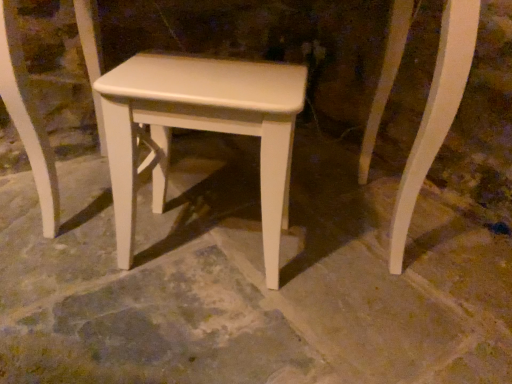
Question: Is white smooth concrete at center touching white matte stool at center?

Choices:
 (A) yes
 (B) no

Answer: (B)

Question: Considering the relative positions of white smooth concrete at center and white matte stool at center in the image provided, is white smooth concrete at center in front of white matte stool at center?

Choices:
 (A) no
 (B) yes

Answer: (B)

Question: From a real-world perspective, is white smooth concrete at center located beneath white matte stool at center?

Choices:
 (A) yes
 (B) no

Answer: (A)

Question: Is white smooth concrete at center to the left of white matte stool at center from the viewer's perspective?

Choices:
 (A) yes
 (B) no

Answer: (B)

Question: Does white smooth concrete at center have a greater width compared to white matte stool at center?

Choices:
 (A) yes
 (B) no

Answer: (A)

Question: From the image's perspective, would you say white smooth concrete at center is positioned over white matte stool at center?

Choices:
 (A) no
 (B) yes

Answer: (A)

Question: Considering the relative sizes of white matte stool at center and white smooth concrete at center in the image provided, is white matte stool at center shorter than white smooth concrete at center?

Choices:
 (A) no
 (B) yes

Answer: (A)

Question: Is white matte stool at center taller than white smooth concrete at center?

Choices:
 (A) no
 (B) yes

Answer: (B)

Question: Does white matte stool at center turn towards white smooth concrete at center?

Choices:
 (A) yes
 (B) no

Answer: (B)

Question: From a real-world perspective, is white matte stool at center beneath white smooth concrete at center?

Choices:
 (A) yes
 (B) no

Answer: (B)

Question: Is the depth of white matte stool at center less than that of white smooth concrete at center?

Choices:
 (A) yes
 (B) no

Answer: (B)

Question: Does white matte stool at center have a larger size compared to white smooth concrete at center?

Choices:
 (A) no
 (B) yes

Answer: (A)

Question: In terms of width, does white matte stool at center look wider or thinner when compared to white smooth concrete at center?

Choices:
 (A) wide
 (B) thin

Answer: (B)